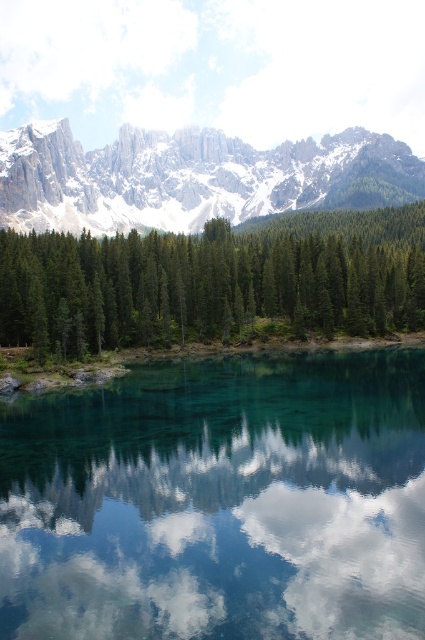
Question: Which object is the farthest from the green matte trees at center?

Choices:
 (A) white fluffy cloud at center
 (B) transparent glass water at center
 (C) snowy granite mountain range at upper center

Answer: (C)

Question: Is green matte trees at center smaller than white fluffy cloud at center?

Choices:
 (A) no
 (B) yes

Answer: (A)

Question: Observing the image, what is the correct spatial positioning of transparent glass water at center in reference to snowy granite mountain range at upper center?

Choices:
 (A) left
 (B) right

Answer: (A)

Question: Does transparent glass water at center have a smaller size compared to snowy granite mountain range at upper center?

Choices:
 (A) yes
 (B) no

Answer: (A)

Question: Which of the following is the closest to the observer?

Choices:
 (A) [122, 170]
 (B) [170, 580]

Answer: (B)

Question: Which of these objects is positioned closest to the transparent glass water at center?

Choices:
 (A) white fluffy cloud at center
 (B) snowy granite mountain range at upper center
 (C) green matte trees at center

Answer: (A)